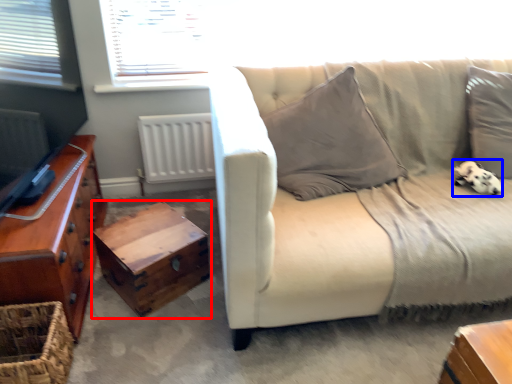
Question: Which point is closer to the camera, table (highlighted by a red box) or animal (highlighted by a blue box)?

Choices:
 (A) table
 (B) animal

Answer: (A)